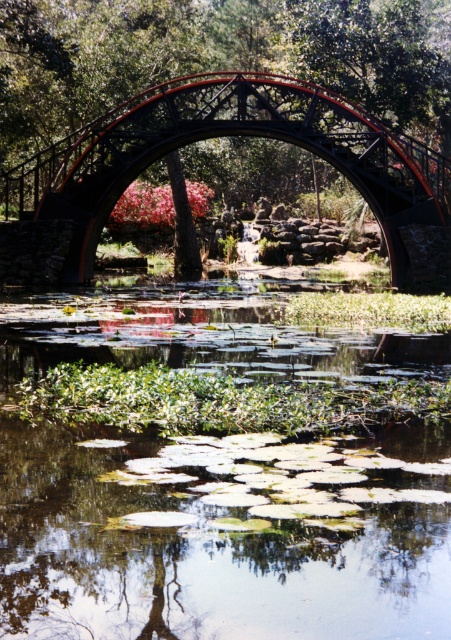
Does green leafy water at center have a greater width compared to black metal bridge at center?

No, green leafy water at center is not wider than black metal bridge at center.

Who is taller, green leafy water at center or black metal bridge at center?

black metal bridge at center is taller.

Where is `green leafy water at center`? The height and width of the screenshot is (640, 451). green leafy water at center is located at coordinates (217, 484).

Where is `green leafy water at center`? The image size is (451, 640). green leafy water at center is located at coordinates (217, 484).